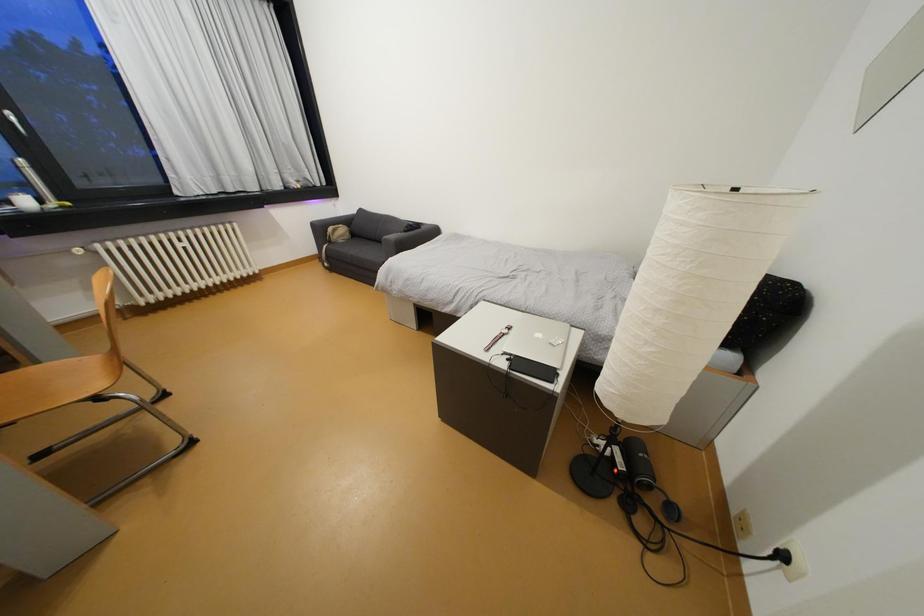
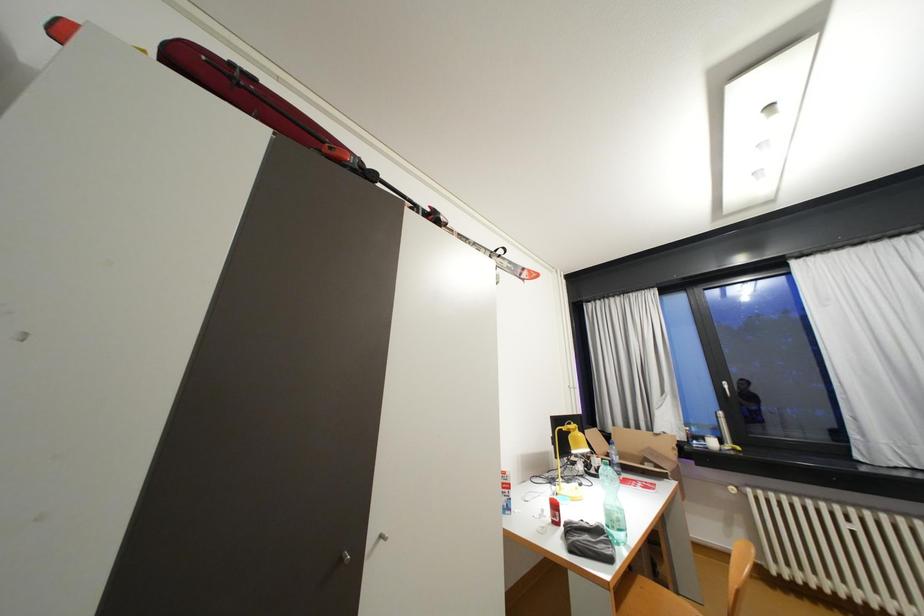
Question: How did the camera likely rotate?

Choices:
 (A) Left
 (B) Right
 (C) Up
 (D) Down

Answer: (A)